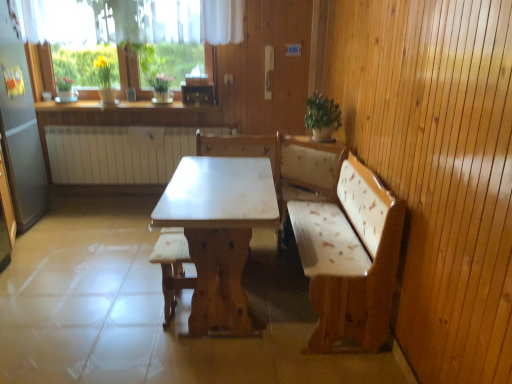
Question: Should I look upward or downward to see white marble table at center?

Choices:
 (A) down
 (B) up

Answer: (A)

Question: Is light brown wood table at center bigger than white marble table at center?

Choices:
 (A) yes
 (B) no

Answer: (A)

Question: From a real-world perspective, is light brown wood table at center located beneath white marble table at center?

Choices:
 (A) yes
 (B) no

Answer: (B)

Question: Considering the relative sizes of light brown wood table at center and white marble table at center in the image provided, is light brown wood table at center shorter than white marble table at center?

Choices:
 (A) no
 (B) yes

Answer: (A)

Question: Are light brown wood table at center and white marble table at center located far from each other?

Choices:
 (A) yes
 (B) no

Answer: (B)

Question: Is white marble table at center at the back of light brown wood table at center?

Choices:
 (A) no
 (B) yes

Answer: (B)

Question: Does light brown wood table at center lie in front of white marble table at center?

Choices:
 (A) no
 (B) yes

Answer: (B)

Question: Could green leafy plant at upper center be considered to be inside light brown wood table at center?

Choices:
 (A) yes
 (B) no

Answer: (B)

Question: From a real-world perspective, does light brown wood table at center stand above green leafy plant at upper center?

Choices:
 (A) no
 (B) yes

Answer: (A)

Question: Is light brown wood table at center to the left of green leafy plant at upper center from the viewer's perspective?

Choices:
 (A) no
 (B) yes

Answer: (B)

Question: Is light brown wood table at center closer to the viewer compared to green leafy plant at upper center?

Choices:
 (A) no
 (B) yes

Answer: (B)

Question: Considering the relative sizes of light brown wood table at center and green leafy plant at upper center in the image provided, is light brown wood table at center smaller than green leafy plant at upper center?

Choices:
 (A) no
 (B) yes

Answer: (A)

Question: Is light brown wood table at center not inside green leafy plant at upper center?

Choices:
 (A) yes
 (B) no

Answer: (A)

Question: Considering the relative positions of white glossy counter top at upper center and light brown wood table at center in the image provided, is white glossy counter top at upper center to the right of light brown wood table at center from the viewer's perspective?

Choices:
 (A) no
 (B) yes

Answer: (A)